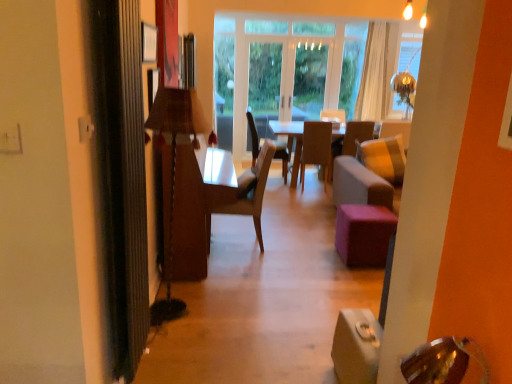
Question: Considering their positions, is purple fabric stool at center located in front of or behind wooden chair at center, which is counted as the third chair, starting from the front?

Choices:
 (A) front
 (B) behind

Answer: (A)

Question: Considering the positions of purple fabric stool at center and wooden chair at center, which is counted as the third chair, starting from the front, in the image, is purple fabric stool at center bigger or smaller than wooden chair at center, which is counted as the third chair, starting from the front,?

Choices:
 (A) big
 (B) small

Answer: (B)

Question: Considering the real-world distances, which object is closest to the transparent glass door at center?

Choices:
 (A) wooden chair at center, which is counted as the third chair, starting from the front
 (B) purple fabric stool at center
 (C) white sheer curtain at upper right
 (D) light brown wood chair at center, positioned as the first chair in left-to-right order
 (E) light gray fabric armchair at center

Answer: (A)

Question: Which is nearer to the white sheer curtain at upper right?

Choices:
 (A) transparent glass door at center
 (B) wooden lamp at left
 (C) wooden chair at center, positioned as the 2th chair in left-to-right order
 (D) brown leather chair at center, positioned as the first chair in right-to-left order
 (E) light gray fabric armchair at center

Answer: (E)